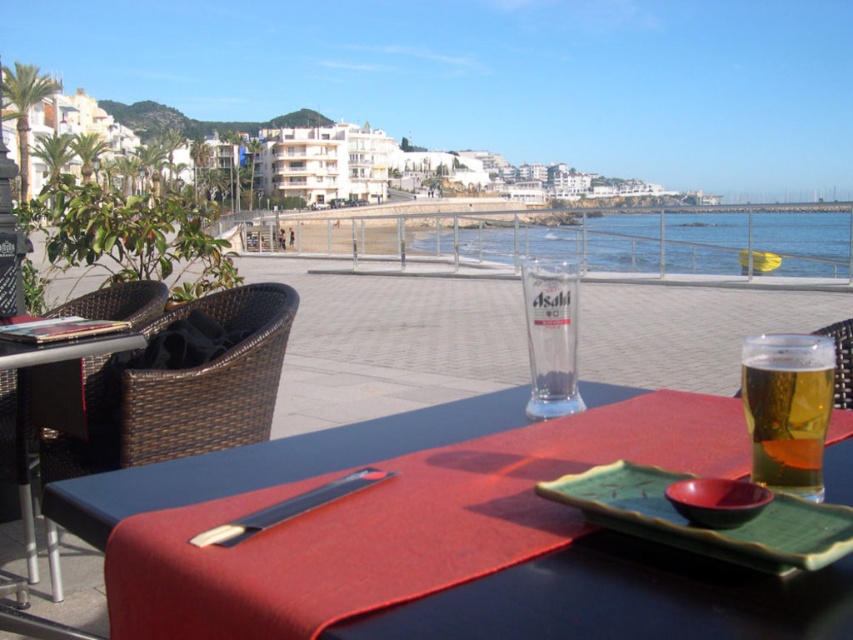
Question: Is smooth dark blue table at center in front of golden translucent glass at center?

Choices:
 (A) yes
 (B) no

Answer: (A)

Question: Among these objects, which one is nearest to the camera?

Choices:
 (A) brown wicker chair at left
 (B) woven wicker chair at lower center

Answer: (B)

Question: Which point appears closest to the camera in this image?

Choices:
 (A) (386, 436)
 (B) (831, 337)

Answer: (A)

Question: Can you confirm if blue water at center is bigger than woven rattan table at left?

Choices:
 (A) yes
 (B) no

Answer: (B)

Question: Does blue water at center appear over golden translucent glass at center?

Choices:
 (A) no
 (B) yes

Answer: (B)

Question: Based on their relative distances, which object is farther from the blue water at center?

Choices:
 (A) woven wicker chair at lower center
 (B) green textured tray at lower right
 (C) smooth dark blue table at center

Answer: (B)